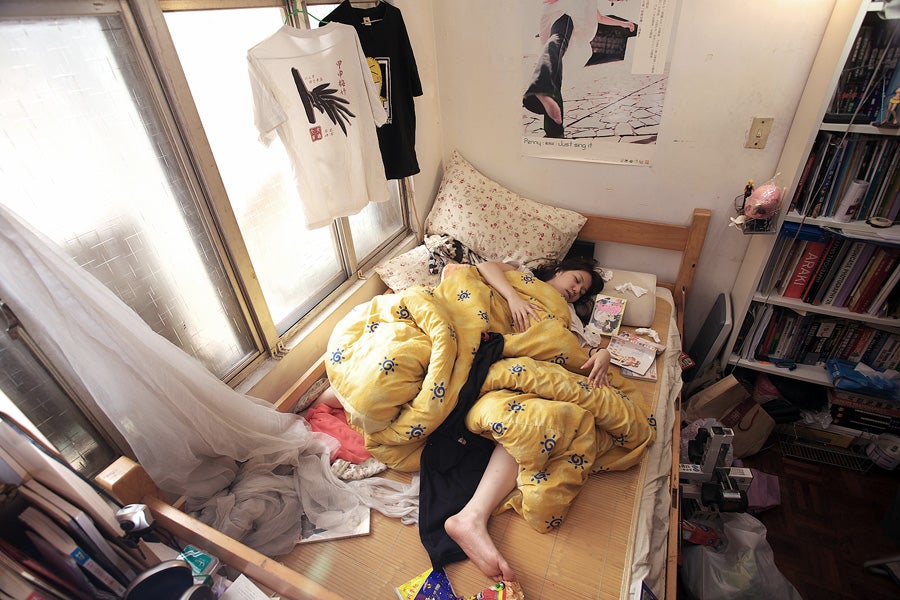
The width and height of the screenshot is (900, 600). Find the location of `pillow`. pillow is located at coordinates (636, 305), (483, 215), (408, 263).